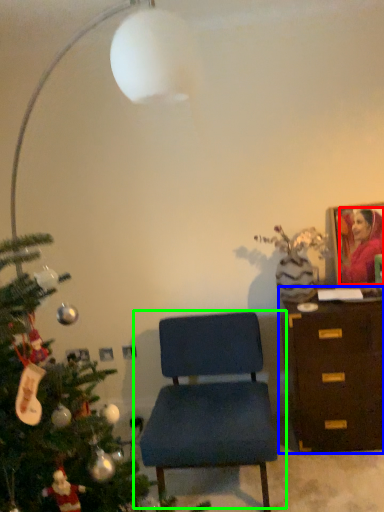
Question: Estimate the real-world distances between objects in this image. Which object is closer to person (highlighted by a red box), chest of drawers (highlighted by a blue box) or chair (highlighted by a green box)?

Choices:
 (A) chest of drawers
 (B) chair

Answer: (A)